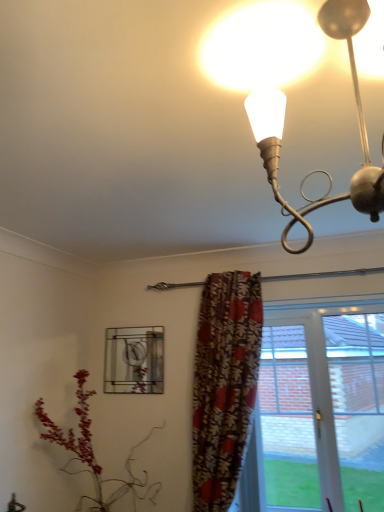
Question: Does point (240, 358) appear closer or farther from the camera than point (124, 362)?

Choices:
 (A) closer
 (B) farther

Answer: (A)

Question: Is floral fabric curtain at center spatially inside stained glass window at center, the 2th window from the right, or outside of it?

Choices:
 (A) inside
 (B) outside

Answer: (B)

Question: Which is farther from the stained glass window at center, the 2th window from the right?

Choices:
 (A) transparent glass door at center, the 2th window positioned from the left
 (B) matte white bulb at upper right
 (C) floral fabric curtain at center

Answer: (B)

Question: Based on their relative distances, which object is nearer to the matte white bulb at upper right?

Choices:
 (A) floral fabric curtain at center
 (B) transparent glass door at center, which is counted as the first window, starting from the right
 (C) stained glass window at center, the 2th window from the right

Answer: (A)